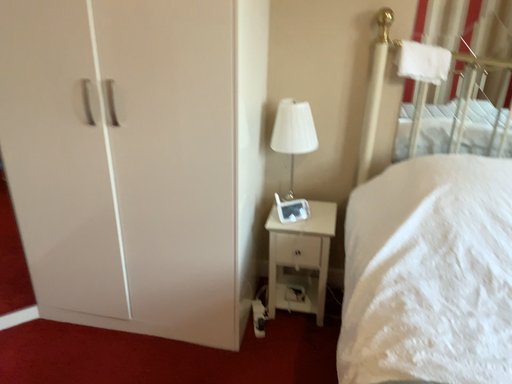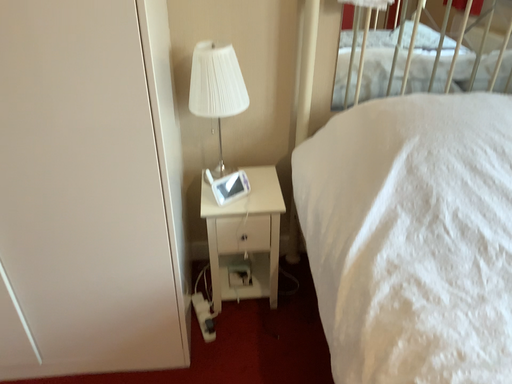
Question: How did the camera likely rotate when shooting the video?

Choices:
 (A) rotated downward
 (B) rotated upward

Answer: (A)